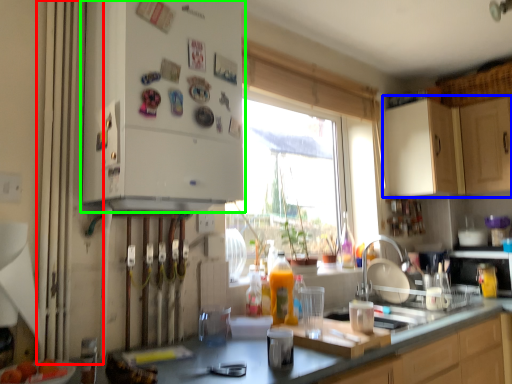
Question: Which object is the closest to the curtain (highlighted by a red box)? Choose among these: cabinetry (highlighted by a blue box) or cabinetry (highlighted by a green box).

Choices:
 (A) cabinetry
 (B) cabinetry

Answer: (B)